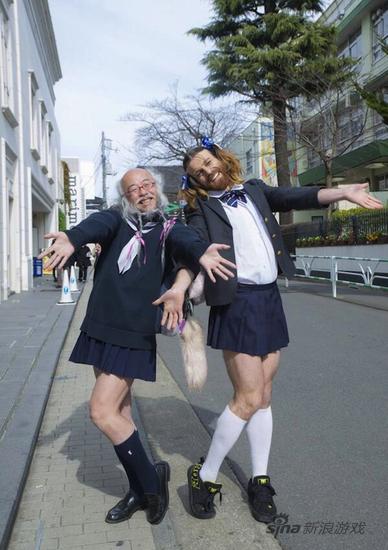
At what (x,y) coordinates should I click in order to perform the action: click on sock. Please return your answer as a coordinate pair (x, y). Looking at the image, I should click on (141, 460), (130, 489), (220, 453), (263, 444).